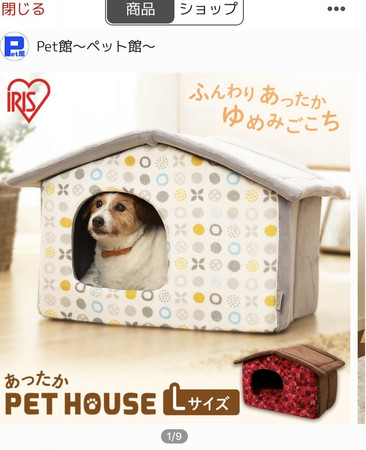
Where is `floor`? floor is located at coordinates (115, 353).